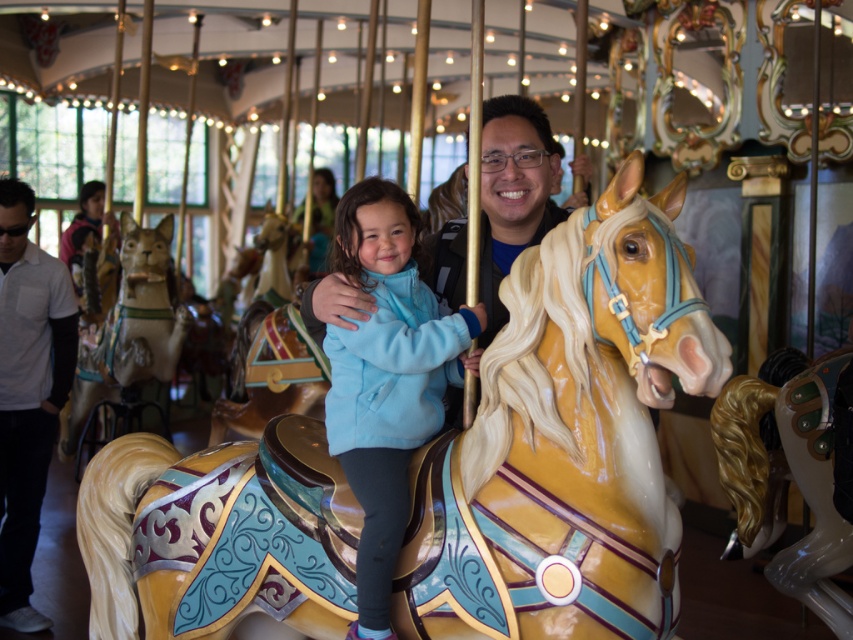
You are a photographer trying to capture a clear shot of the shiny gold horse at center and the shiny gold mane at center. Which object should you focus on first to ensure both are in focus?

The shiny gold horse at center is closer to the viewer than the shiny gold mane at center. To ensure both are in focus, you should focus on the shiny gold horse at center first.

You are at the carousel and see the white matte shirt at left and the shiny gold mane at center. Which one appears larger in size?

The white matte shirt at left is bigger than the shiny gold mane at center.

Consider the image. You are standing at the center of the carousel and see two points marked in the image. The first point is at coordinates point (173, 474) and the second point is at point (838, 531). Which point is closer to you?

Point (173, 474) is in front of point (838, 531), so it is closer to you.